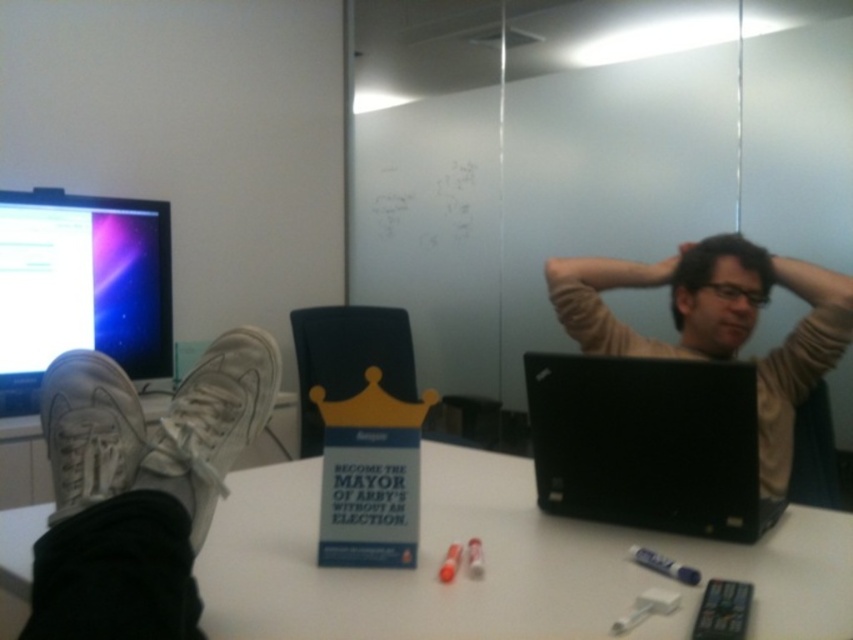
You are a delivery person who needs to place a package on the table. The package is as wide as the white suede shoe at lower left. Can the package fit on the table next to the black matte laptop at center without overlapping it?

The black matte laptop at center is wider than the white suede shoe at lower left. Since the package is as wide as the shoe, it can fit on the table next to the laptop without overlapping, provided there is enough space beside the laptop.

You are a photographer standing at the camera position. You want to place a new object on the white matte table at center so that it is exactly halfway between the camera and the table. Is this possible?

The distance between the white matte table at center and the camera is 36.07 inches. To place an object exactly halfway, it would need to be placed at 18.035 inches from the table. Since the table itself is a surface, you can place the object on the table at that midpoint distance from the camera.

You are a delivery person who needs to place a package on the table in the image. The package is 10 cm tall. Can you place it on the table without it being blocked by the black matte laptop at center or the white suede shoe at lower left?

The black matte laptop at center is much taller than the white suede shoe at lower left. Since the package is only 10 cm tall, it might still be possible to place it on the table in an area not obstructed by these items, but the height of the laptop could block visibility depending on placement.